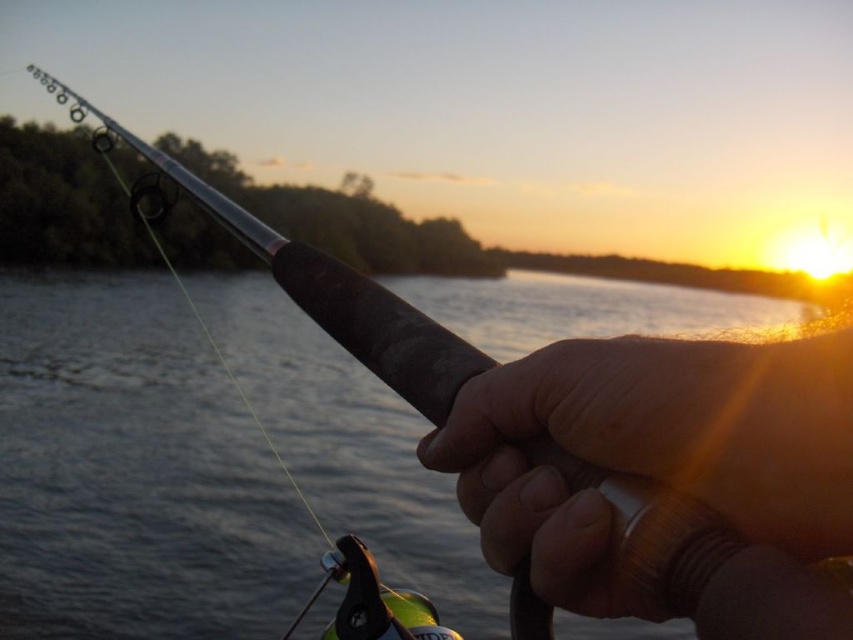
Question: Which of the following is the farthest from the observer?

Choices:
 (A) (48, 577)
 (B) (525, 369)

Answer: (A)

Question: Does translucent water at fishing rod right have a larger size compared to smooth leather handle at center?

Choices:
 (A) yes
 (B) no

Answer: (A)

Question: Which point is farther to the camera?

Choices:
 (A) (689, 436)
 (B) (308, 397)

Answer: (B)

Question: Does translucent water at fishing rod right have a larger size compared to smooth leather handle at center?

Choices:
 (A) yes
 (B) no

Answer: (A)

Question: Which object is closer to the camera taking this photo?

Choices:
 (A) translucent water at fishing rod right
 (B) smooth leather handle at center

Answer: (B)

Question: Is translucent water at fishing rod right positioned at the back of smooth leather handle at center?

Choices:
 (A) yes
 (B) no

Answer: (A)